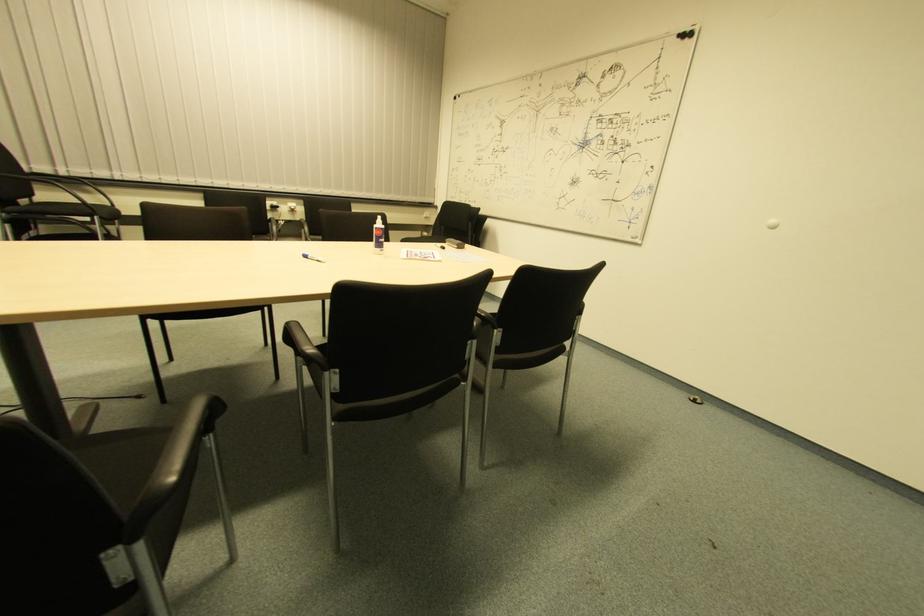
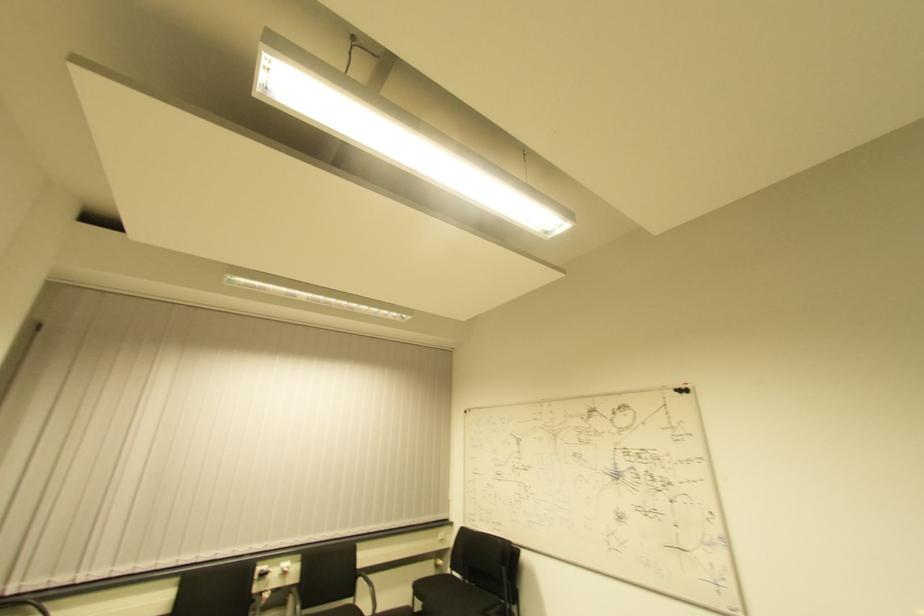
Where in the second image is the point corresponding to [290,214] from the first image?

(283, 576)